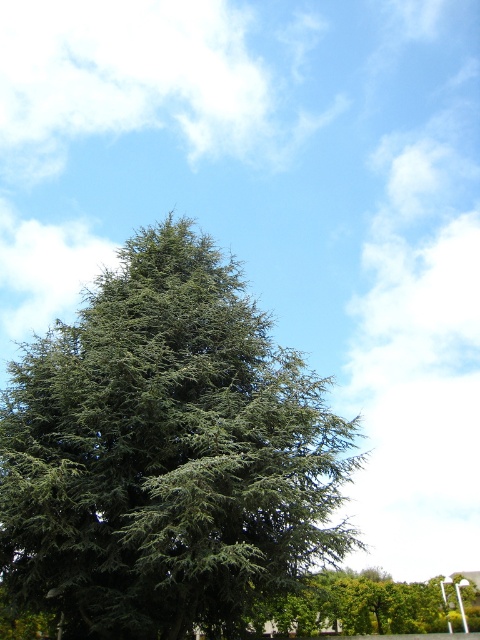
Question: Which of the following is the closest to the observer?

Choices:
 (A) green leafy tree at center
 (B) green needle-like at center

Answer: (A)

Question: Which point appears farthest from the camera in this image?

Choices:
 (A) (404, 620)
 (B) (11, 572)

Answer: (A)

Question: Where is green needle-like at center located in relation to green leafy tree at center in the image?

Choices:
 (A) above
 (B) below

Answer: (A)

Question: Can you confirm if green needle-like at center is thinner than green leafy tree at center?

Choices:
 (A) no
 (B) yes

Answer: (B)

Question: Which object appears closest to the camera in this image?

Choices:
 (A) green leafy tree at center
 (B) green needle-like at center

Answer: (A)

Question: Can you confirm if green needle-like at center is bigger than green leafy tree at center?

Choices:
 (A) no
 (B) yes

Answer: (A)